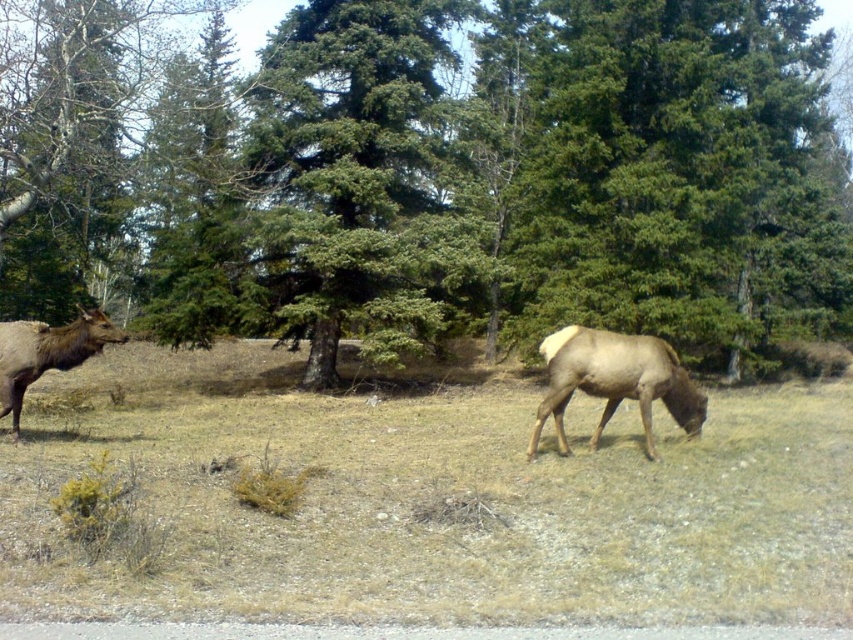
Which is more to the right, green leafy tree at center or brown fur at center?

Positioned to the right is brown fur at center.

Who is more forward, (664, 205) or (830, 452)?

Point (830, 452)

Locate an element on the screen. green leafy tree at center is located at coordinates (439, 176).

Who is positioned more to the left, green leafy tree at center or brown velvet deer at left?

brown velvet deer at left

Is point (450, 156) positioned behind point (3, 323)?

Yes, point (450, 156) is behind point (3, 323).

Who is more distant from viewer, (x=440, y=51) or (x=80, y=342)?

Point (x=440, y=51)

You are a GUI agent. You are given a task and a screenshot of the screen. Output one action in this format:
    pyautogui.click(x=<x>, y=<y>)
    Task: Click on the green leafy tree at center
    The image size is (853, 640).
    Given the screenshot: What is the action you would take?
    point(439,176)

Can you confirm if brown fur at center is smaller than brown velvet deer at left?

Incorrect, brown fur at center is not smaller in size than brown velvet deer at left.

Who is shorter, brown fur at center or brown velvet deer at left?

brown fur at center

Image resolution: width=853 pixels, height=640 pixels. Describe the element at coordinates (434, 500) in the screenshot. I see `brown fur at center` at that location.

At what (x,y) coordinates should I click in order to perform the action: click on brown fur at center. Please return your answer as a coordinate pair (x, y). The image size is (853, 640). Looking at the image, I should click on (434, 500).